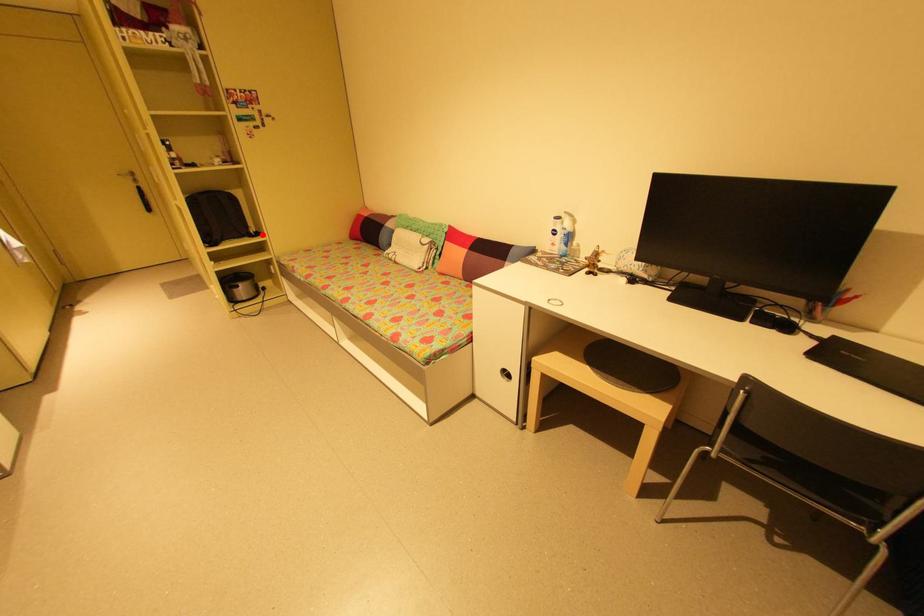
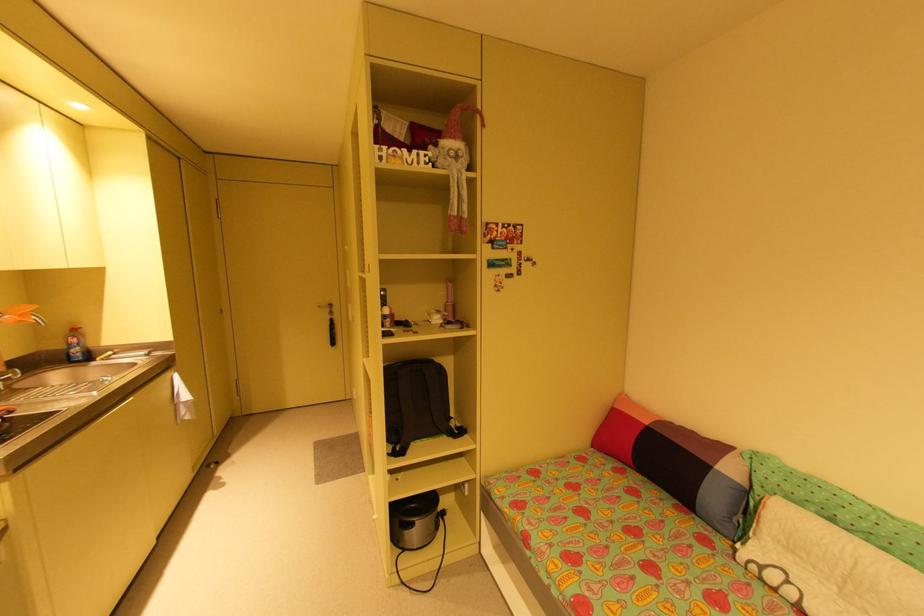
Find the pixel in the second image that matches the highlighted location in the first image.

(466, 431)